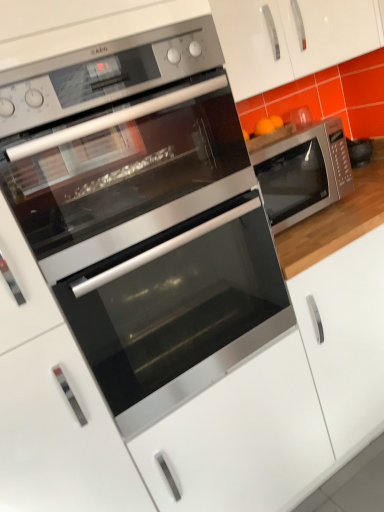
Question: Considering the relative sizes of satin silver oven at center and satin white drawer at center, which is counted as the 2th drawer, starting from the left, in the image provided, is satin silver oven at center smaller than satin white drawer at center, which is counted as the 2th drawer, starting from the left,?

Choices:
 (A) yes
 (B) no

Answer: (A)

Question: Would you say satin white drawer at center, which is counted as the 2th drawer, starting from the left, is part of satin silver oven at center's contents?

Choices:
 (A) no
 (B) yes

Answer: (A)

Question: Is satin silver oven at center to the right of satin white drawer at center, which is the 1th drawer in right-to-left order, from the viewer's perspective?

Choices:
 (A) no
 (B) yes

Answer: (A)

Question: Is satin silver oven at center wider than satin white drawer at center, which is counted as the 2th drawer, starting from the left?

Choices:
 (A) no
 (B) yes

Answer: (A)

Question: Does satin silver oven at center have a larger size compared to satin white drawer at center, which is the 1th drawer in right-to-left order?

Choices:
 (A) yes
 (B) no

Answer: (B)

Question: From the image's perspective, is satin silver oven at center beneath satin white drawer at center, which is the 1th drawer in right-to-left order?

Choices:
 (A) no
 (B) yes

Answer: (A)

Question: Considering the relative sizes of satin white drawer at center, which is the 1th drawer in right-to-left order, and stainless steel microwave at right, placed as the 1th microwave oven when sorted from front to back, in the image provided, is satin white drawer at center, which is the 1th drawer in right-to-left order, bigger than stainless steel microwave at right, placed as the 1th microwave oven when sorted from front to back,?

Choices:
 (A) yes
 (B) no

Answer: (A)

Question: Is satin white drawer at center, which is the 1th drawer in right-to-left order, outside stainless steel microwave at right, the second microwave oven when ordered from back to front?

Choices:
 (A) no
 (B) yes

Answer: (B)

Question: Is satin white drawer at center, which is counted as the 2th drawer, starting from the left, to the right of stainless steel microwave at right, the second microwave oven when ordered from back to front, from the viewer's perspective?

Choices:
 (A) yes
 (B) no

Answer: (A)

Question: Can you confirm if satin white drawer at center, which is the 1th drawer in right-to-left order, is shorter than stainless steel microwave at right, the 1th microwave oven when ordered from left to right?

Choices:
 (A) no
 (B) yes

Answer: (A)

Question: From a real-world perspective, is satin white drawer at center, which is the 1th drawer in right-to-left order, on stainless steel microwave at right, the second microwave oven when ordered from back to front?

Choices:
 (A) no
 (B) yes

Answer: (A)

Question: Does satin white drawer at center, which is the 1th drawer in right-to-left order, have a lesser width compared to stainless steel microwave at right, the second microwave oven when ordered from back to front?

Choices:
 (A) yes
 (B) no

Answer: (B)

Question: From a real-world perspective, is stainless steel microwave at right, the first microwave oven viewed from the back, physically below satin silver oven at center?

Choices:
 (A) no
 (B) yes

Answer: (A)